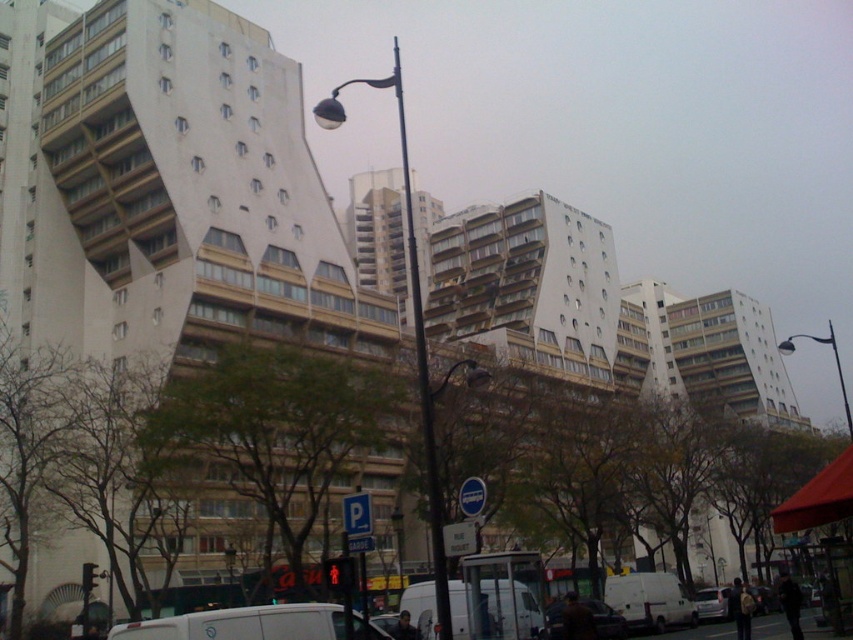
Between black metal pole at center and metallic silver car at center, which one is positioned lower?

metallic silver car at center is below.

Can you confirm if black metal pole at center is positioned below metallic silver car at center?

Actually, black metal pole at center is above metallic silver car at center.

You are a GUI agent. You are given a task and a screenshot of the screen. Output one action in this format:
    pyautogui.click(x=<x>, y=<y>)
    Task: Click on the black metal pole at center
    This screenshot has height=640, width=853.
    Given the screenshot: What is the action you would take?
    pyautogui.click(x=421, y=369)

The height and width of the screenshot is (640, 853). I want to click on black metal pole at center, so click(421, 369).

Is point (280, 609) in front of point (421, 316)?

Yes, point (280, 609) is in front of point (421, 316).

Does white matte van at lower center have a smaller size compared to black metal pole at center?

Correct, white matte van at lower center occupies less space than black metal pole at center.

Is point (283, 611) in front of point (418, 289)?

Yes, point (283, 611) is in front of point (418, 289).

Locate an element on the screen. This screenshot has width=853, height=640. white matte van at lower center is located at coordinates (242, 624).

Does matte black street light at center appear under white matte van at lower center?

No.

Does matte black street light at center have a larger size compared to white matte van at lower center?

Yes, matte black street light at center is bigger than white matte van at lower center.

Is point (410, 252) positioned before point (242, 627)?

No.

This screenshot has height=640, width=853. Find the location of `matte black street light at center`. matte black street light at center is located at coordinates pos(413,330).